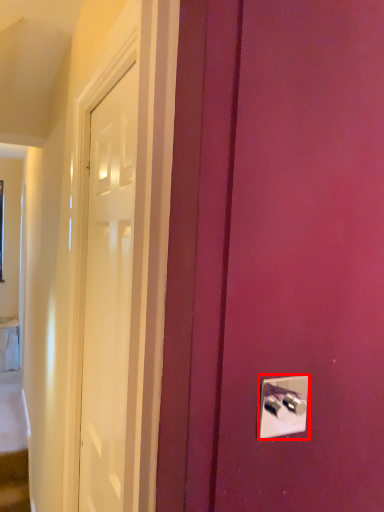
Question: Where is light switch (annotated by the red box) located in relation to door in the image?

Choices:
 (A) right
 (B) left

Answer: (A)